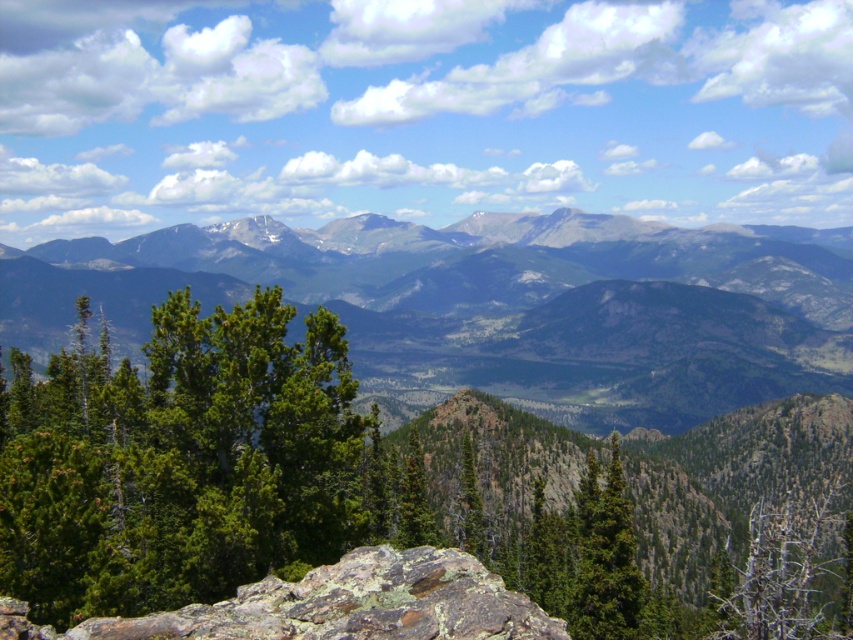
Question: Is lichen-covered rock at center positioned at the back of green matte tree at center-right?

Choices:
 (A) yes
 (B) no

Answer: (B)

Question: Among these points, which one is nearest to the camera?

Choices:
 (A) (744, 596)
 (B) (468, 458)
 (C) (314, 616)

Answer: (C)

Question: Estimate the real-world distances between objects in this image. Which object is farther from the dead wood at lower right?

Choices:
 (A) green forested mountain range at center
 (B) green needle-like at left

Answer: (A)

Question: Can you confirm if green forested mountain range at center is positioned below dead wood at lower right?

Choices:
 (A) no
 (B) yes

Answer: (A)

Question: Considering the real-world distances, which object is farthest from the green matte tree at center?

Choices:
 (A) green forested mountain range at center
 (B) dead wood at lower right
 (C) green matte tree at center-right

Answer: (A)

Question: Is green matte tree at center-right bigger than green matte tree at center?

Choices:
 (A) no
 (B) yes

Answer: (B)